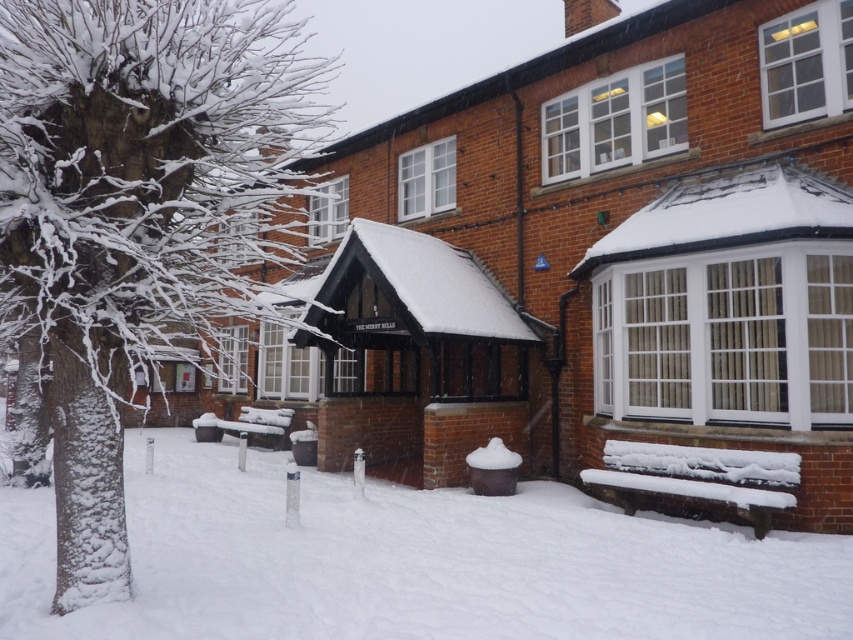
How much distance is there between snow-covered tree at left and white fluffy snow at lower center?

snow-covered tree at left is 5.33 meters away from white fluffy snow at lower center.

Where is `snow-covered tree at left`? This screenshot has height=640, width=853. snow-covered tree at left is located at coordinates (138, 212).

Which is in front, point (109, 536) or point (335, 502)?

Point (109, 536) is more forward.

Find the location of `snow-covered tree at left`. snow-covered tree at left is located at coordinates (138, 212).

Can you confirm if white fluffy snow at lower center is smaller than snow-covered wooden bench at lower right?

No.

What do you see at coordinates (410, 561) in the screenshot?
I see `white fluffy snow at lower center` at bounding box center [410, 561].

This screenshot has width=853, height=640. Describe the element at coordinates (410, 561) in the screenshot. I see `white fluffy snow at lower center` at that location.

The width and height of the screenshot is (853, 640). I want to click on white fluffy snow at lower center, so click(x=410, y=561).

Is snow-covered tree at left to the right of wooden bench at center from the viewer's perspective?

In fact, snow-covered tree at left is to the left of wooden bench at center.

Is point (103, 550) closer to camera compared to point (231, 422)?

Yes, it is.

Find the location of a particular element. The image size is (853, 640). snow-covered tree at left is located at coordinates (138, 212).